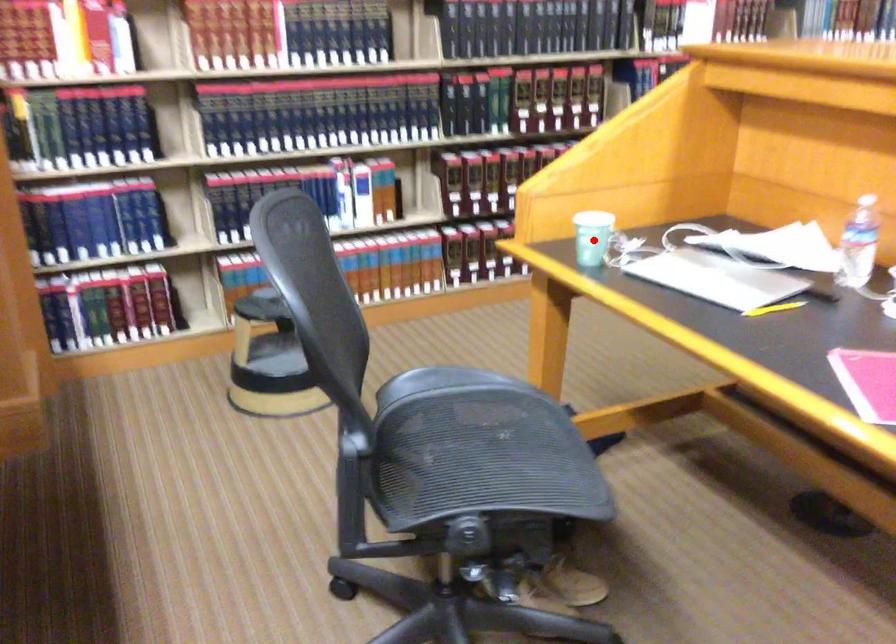
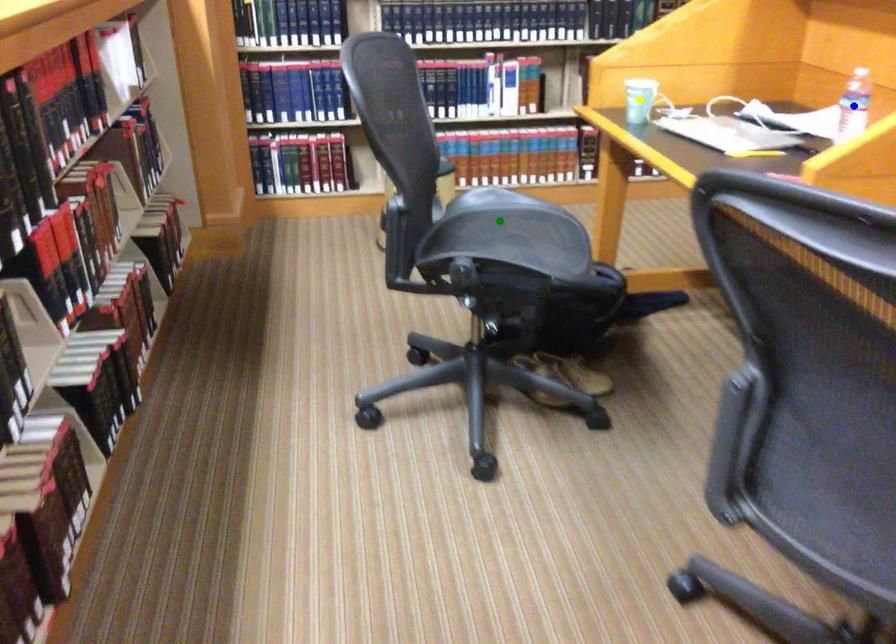
Question: I am providing you with two images of the same scene from different viewpoints. A red point is marked on the first image. You are given multiple points on the second image. Can you choose the point in image 2 that corresponds to the point in image 1?

Choices:
 (A) blue point
 (B) yellow point
 (C) green point

Answer: (B)